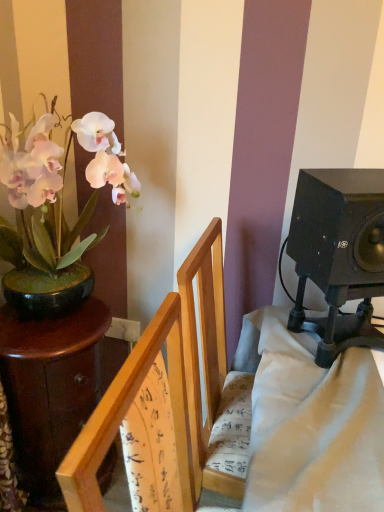
Question: From a real-world perspective, is dark brown wooden table at left beneath white matte orchid at left?

Choices:
 (A) yes
 (B) no

Answer: (A)

Question: Does dark brown wooden table at left come in front of white matte orchid at left?

Choices:
 (A) yes
 (B) no

Answer: (B)

Question: Does dark brown wooden table at left appear on the right side of white matte orchid at left?

Choices:
 (A) yes
 (B) no

Answer: (B)

Question: Is the position of dark brown wooden table at left more distant than that of white matte orchid at left?

Choices:
 (A) yes
 (B) no

Answer: (A)

Question: Does dark brown wooden table at left have a lesser width compared to white matte orchid at left?

Choices:
 (A) yes
 (B) no

Answer: (A)

Question: Does dark brown wooden table at left have a larger size compared to white matte orchid at left?

Choices:
 (A) no
 (B) yes

Answer: (A)

Question: Considering the relative sizes of black matte speaker at right and wooden chair at center in the image provided, is black matte speaker at right shorter than wooden chair at center?

Choices:
 (A) no
 (B) yes

Answer: (B)

Question: Considering the relative positions of black matte speaker at right and wooden chair at center in the image provided, is black matte speaker at right to the right of wooden chair at center from the viewer's perspective?

Choices:
 (A) no
 (B) yes

Answer: (B)

Question: Does black matte speaker at right have a smaller size compared to wooden chair at center?

Choices:
 (A) no
 (B) yes

Answer: (B)

Question: Can you confirm if black matte speaker at right is taller than wooden chair at center?

Choices:
 (A) no
 (B) yes

Answer: (A)

Question: From a real-world perspective, is black matte speaker at right below wooden chair at center?

Choices:
 (A) yes
 (B) no

Answer: (B)

Question: Is black matte speaker at right with wooden chair at center?

Choices:
 (A) no
 (B) yes

Answer: (A)

Question: Considering the relative sizes of black matte speaker at right and dark brown wooden table at left in the image provided, is black matte speaker at right taller than dark brown wooden table at left?

Choices:
 (A) yes
 (B) no

Answer: (B)